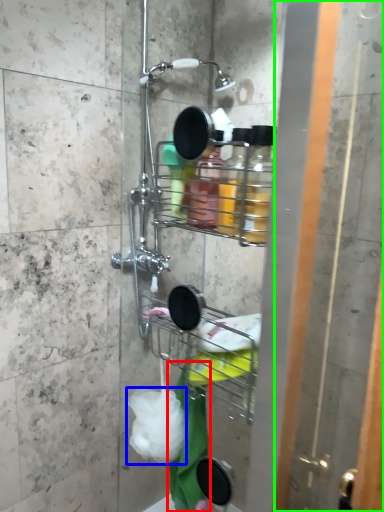
Question: Considering the real-world distances, which object is farthest from bath towel (highlighted by a red box)? plastic (highlighted by a blue box) or screen door (highlighted by a green box)?

Choices:
 (A) plastic
 (B) screen door

Answer: (B)